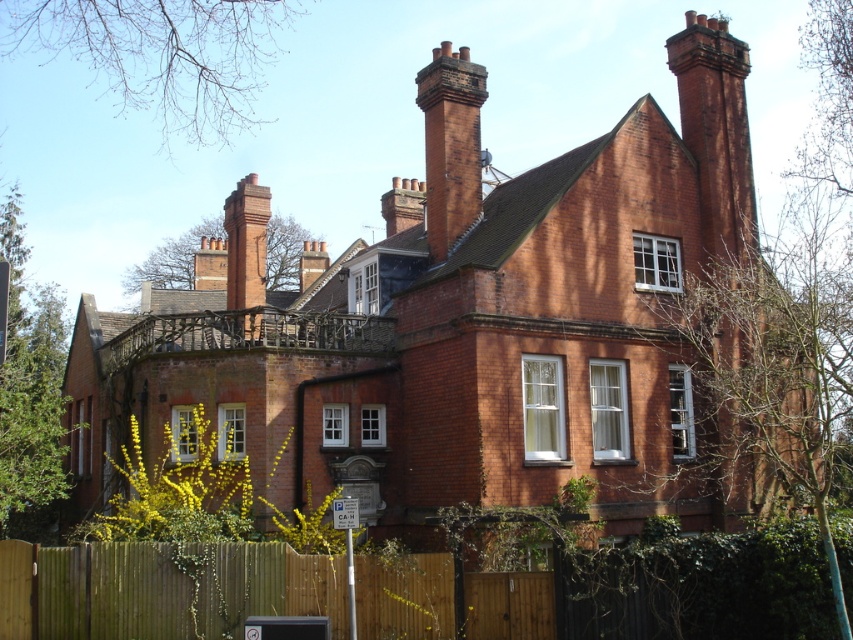
Question: Is brown wooden fence at lower center above red brick chimney at upper center?

Choices:
 (A) yes
 (B) no

Answer: (B)

Question: Is red brick chimney at upper center further to camera compared to red brick chimney at upper left?

Choices:
 (A) no
 (B) yes

Answer: (B)

Question: Estimate the real-world distances between objects in this image. Which object is closer to the red brick chimney at upper left?

Choices:
 (A) brown wooden fence at lower center
 (B) red brick chimney at upper center

Answer: (B)

Question: Considering the relative positions of brown wooden fence at lower center and red brick chimney at upper left in the image provided, where is brown wooden fence at lower center located with respect to red brick chimney at upper left?

Choices:
 (A) left
 (B) right

Answer: (B)

Question: Among these points, which one is farthest from the camera?

Choices:
 (A) (432, 225)
 (B) (35, 545)

Answer: (A)

Question: Which point is closer to the camera taking this photo?

Choices:
 (A) (508, 620)
 (B) (434, 160)

Answer: (A)